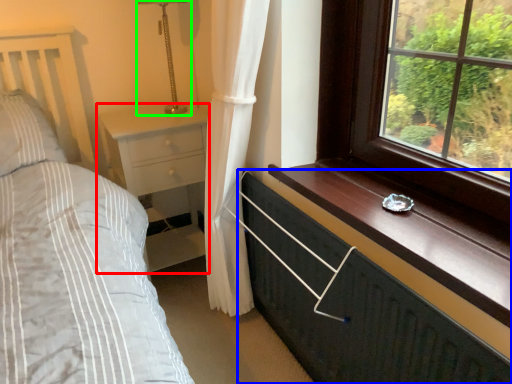
Question: Estimate the real-world distances between objects in this image. Which object is farther from nightstand (highlighted by a red box), chest of drawers (highlighted by a blue box) or table lamp (highlighted by a green box)?

Choices:
 (A) chest of drawers
 (B) table lamp

Answer: (A)